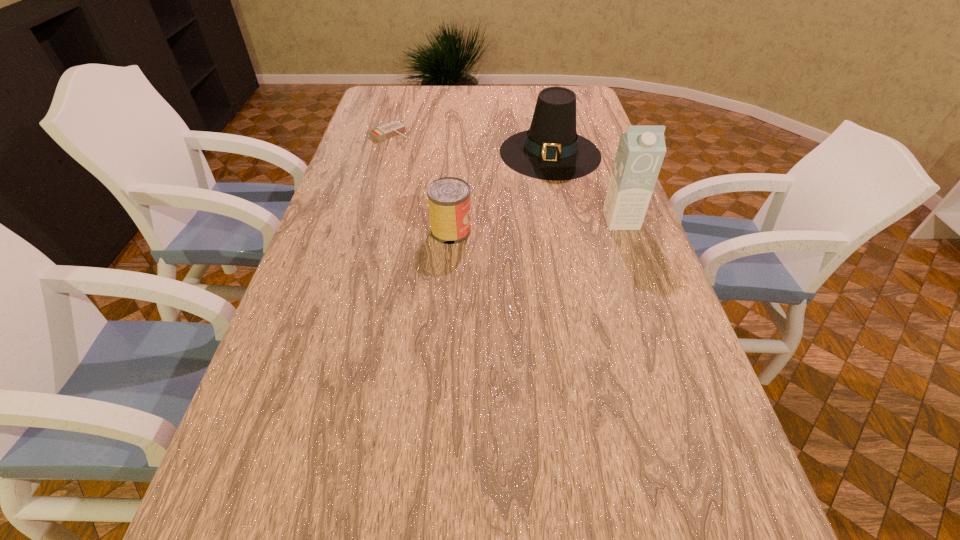
Find the location of a particular element. free spot between the carton and the third shortest object is located at coordinates (586, 186).

Find the location of `empty location between the carton and the second tallest object`. empty location between the carton and the second tallest object is located at coordinates (586, 186).

Locate which object is the third closest to the hat. Please provide its 2D coordinates. Your answer should be formatted as a tuple, i.e. [(x, y)], where the tuple contains the x and y coordinates of a point satisfying the conditions above.

[(384, 132)]

You are a GUI agent. You are given a task and a screenshot of the screen. Output one action in this format:
    pyautogui.click(x=<x>, y=<y>)
    Task: Click on the object that is the third closest to the second tallest object
    The width and height of the screenshot is (960, 540).
    Given the screenshot: What is the action you would take?
    tap(384, 132)

The height and width of the screenshot is (540, 960). In order to click on free space that satisfies the following two spatial constraints: 1. on the front side of the matchbox; 2. on the right side of the hat in this screenshot , I will do `click(384, 153)`.

At what (x,y) coordinates should I click in order to perform the action: click on free space in the image that satisfies the following two spatial constraints: 1. on the back side of the second tallest object; 2. on the left side of the can. Please return your answer as a coordinate pair (x, y). Looking at the image, I should click on (456, 153).